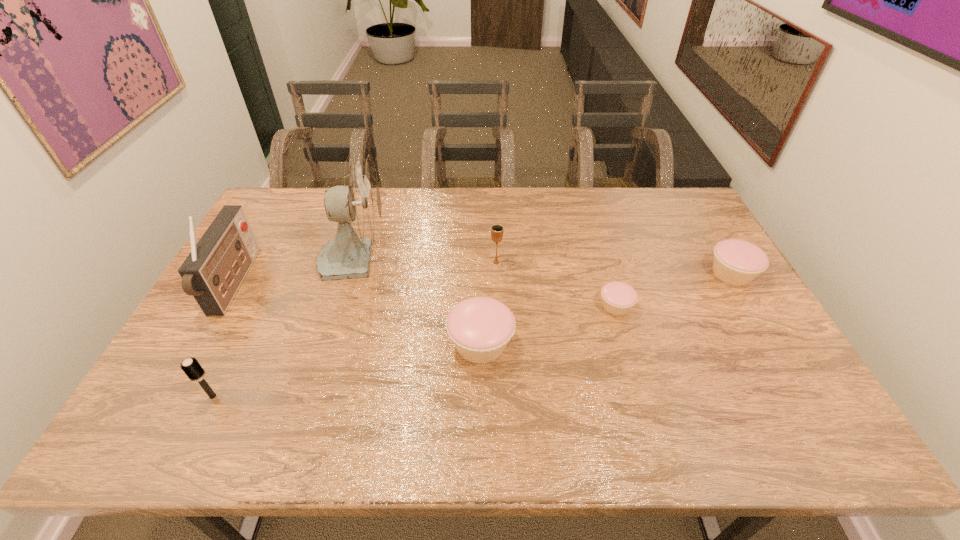
The image size is (960, 540). Find the location of `the leftmost cupcake`. the leftmost cupcake is located at coordinates (480, 327).

Locate an element on the screen. the sixth object from left to right is located at coordinates pos(618,298).

Find the location of a particular element. the shortest object is located at coordinates (618, 298).

The image size is (960, 540). I want to click on the rightmost object, so click(x=736, y=262).

Find the location of a particular element. The width and height of the screenshot is (960, 540). the farthest cupcake is located at coordinates (736, 262).

You are a GUI agent. You are given a task and a screenshot of the screen. Output one action in this format:
    pyautogui.click(x=<x>, y=<y>)
    Task: Click on the leftmost object
    
    Given the screenshot: What is the action you would take?
    pyautogui.click(x=212, y=273)

Where is `the second tallest object`? the second tallest object is located at coordinates (212, 273).

Find the location of a particular element. This screenshot has height=540, width=960. the tallest object is located at coordinates (357, 207).

The width and height of the screenshot is (960, 540). In order to click on fan in this screenshot , I will do `click(357, 207)`.

The image size is (960, 540). I want to click on chalice, so click(497, 230).